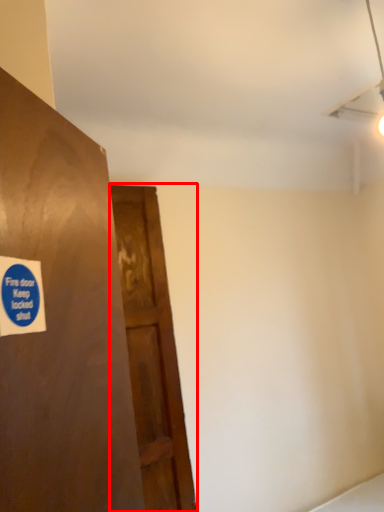
Question: From the image's perspective, where is door (annotated by the red box) located relative to sticker?

Choices:
 (A) below
 (B) above

Answer: (A)